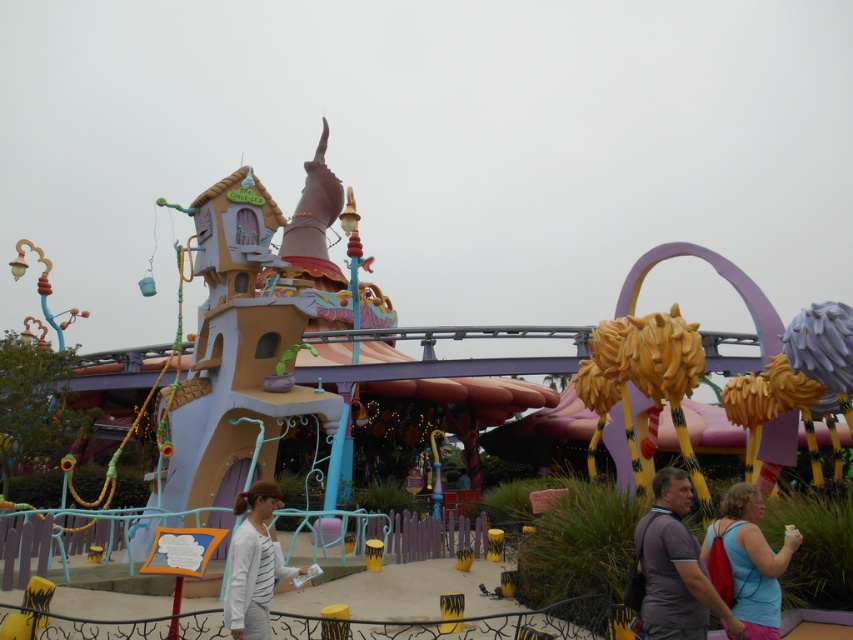
The image size is (853, 640). What do you see at coordinates (675, 566) in the screenshot?
I see `gray fabric shirt at lower center` at bounding box center [675, 566].

Does point (695, 580) lie in front of point (230, 556)?

Yes, point (695, 580) is in front of point (230, 556).

Between point (648, 596) and point (265, 561), which one is positioned in front?

Point (648, 596) is in front.

Locate an element on the screen. gray fabric shirt at lower center is located at coordinates (675, 566).

Which of these two, gray fabric shirt at lower center or blue fabric backpack at lower right, stands taller?

Standing taller between the two is gray fabric shirt at lower center.

Which is more to the right, gray fabric shirt at lower center or blue fabric backpack at lower right?

Positioned to the right is blue fabric backpack at lower right.

Which is behind, point (682, 570) or point (753, 624)?

Point (682, 570)

Locate an element on the screen. Image resolution: width=853 pixels, height=640 pixels. gray fabric shirt at lower center is located at coordinates [x=675, y=566].

Who is positioned more to the right, blue fabric backpack at lower right or white striped shirt at center?

Positioned to the right is blue fabric backpack at lower right.

The image size is (853, 640). Describe the element at coordinates (750, 561) in the screenshot. I see `blue fabric backpack at lower right` at that location.

Locate an element on the screen. This screenshot has height=640, width=853. blue fabric backpack at lower right is located at coordinates (750, 561).

At what (x,y) coordinates should I click in order to perform the action: click on blue fabric backpack at lower right. Please return your answer as a coordinate pair (x, y). The image size is (853, 640). Looking at the image, I should click on (750, 561).